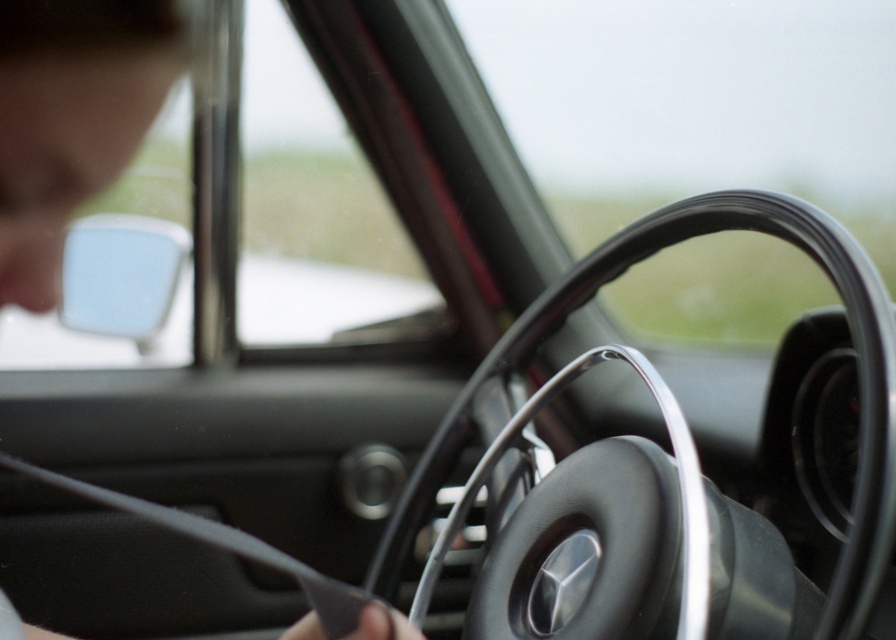
Question: Is matte black hair at upper left wider than black leather steering wheel at center?

Choices:
 (A) yes
 (B) no

Answer: (B)

Question: Can you confirm if matte black hair at upper left is smaller than black leather steering wheel at center?

Choices:
 (A) yes
 (B) no

Answer: (A)

Question: Can you confirm if matte black hair at upper left is positioned to the right of black leather steering wheel at center?

Choices:
 (A) no
 (B) yes

Answer: (A)